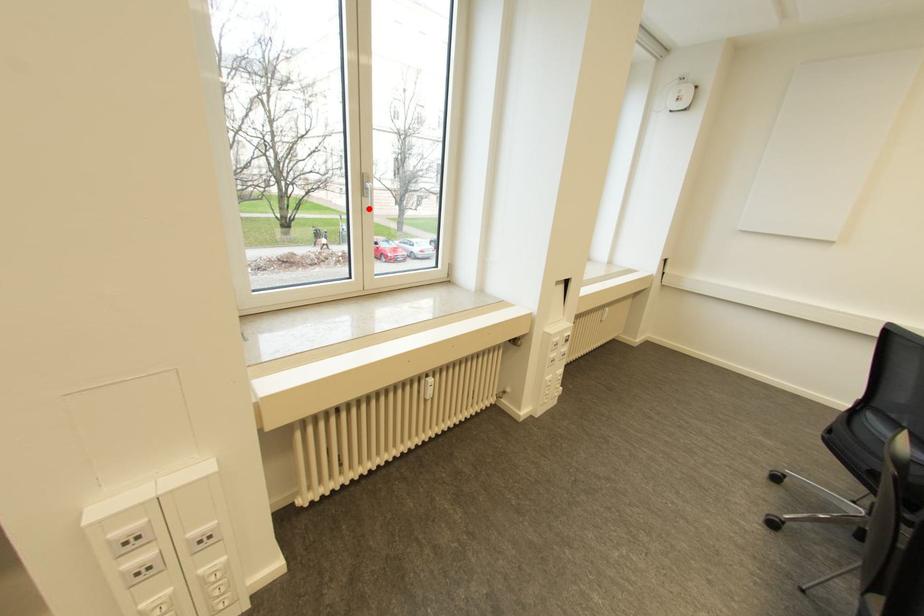
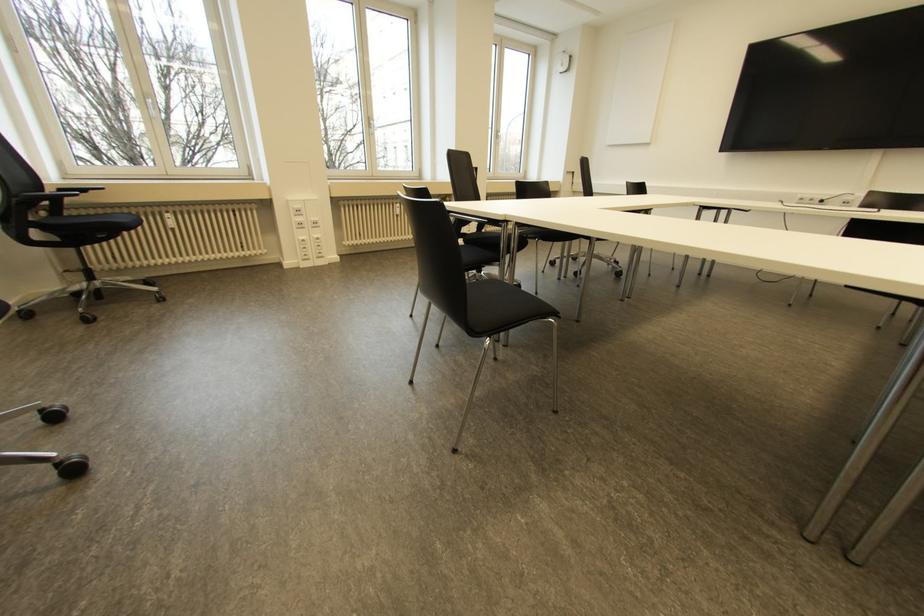
Question: A red point is marked in image1. In image2, is the corresponding 3D point closer to the camera or farther? Reply with the corresponding letter.

Choices:
 (A) The corresponding 3D point is closer.
 (B) The corresponding 3D point is farther.

Answer: (A)